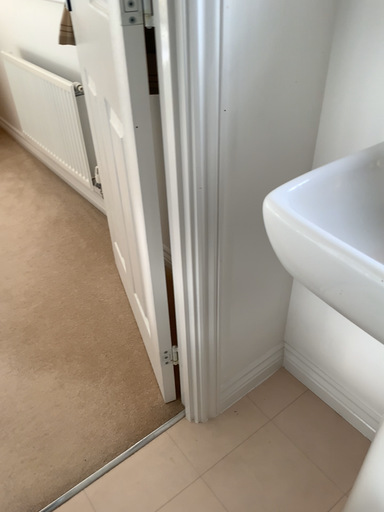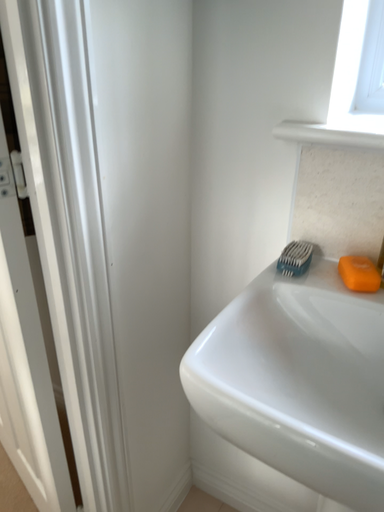
Question: How did the camera likely rotate when shooting the video?

Choices:
 (A) rotated left
 (B) rotated right

Answer: (B)